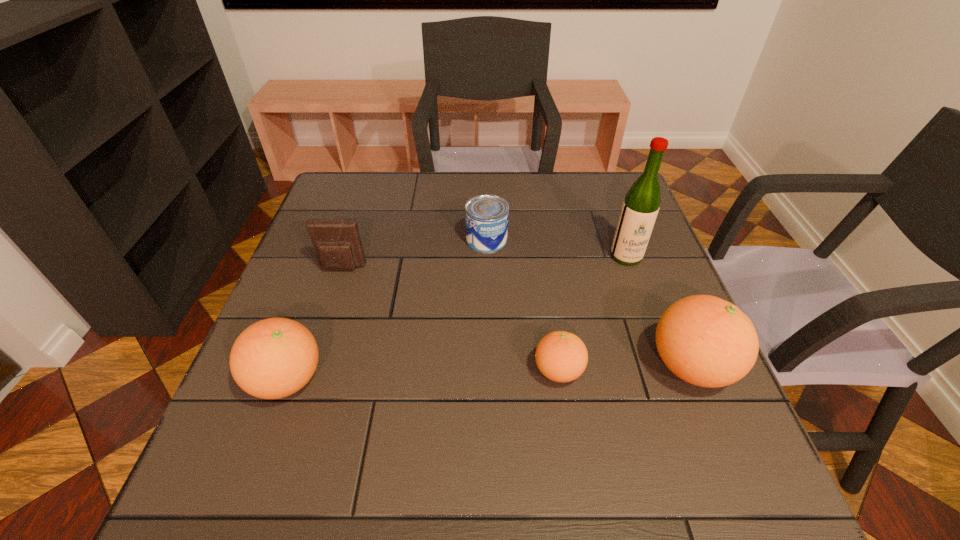
In order to click on the second shortest orange in this screenshot , I will do `click(273, 358)`.

The image size is (960, 540). In order to click on the second orange from left to right in this screenshot , I will do `click(561, 356)`.

Where is `the shortest orange`? The height and width of the screenshot is (540, 960). the shortest orange is located at coordinates point(561,356).

Locate an element on the screen. The height and width of the screenshot is (540, 960). the rightmost orange is located at coordinates (706, 341).

At what (x,y) coordinates should I click in order to perform the action: click on the third object from left to right. Please return your answer as a coordinate pair (x, y). Looking at the image, I should click on (487, 216).

Locate an element on the screen. This screenshot has height=540, width=960. pouch is located at coordinates (337, 244).

Locate an element on the screen. The width and height of the screenshot is (960, 540). the tallest object is located at coordinates (640, 208).

This screenshot has width=960, height=540. Identify the location of vacant area situated 0.130m on the back of the leftmost orange. (315, 303).

Where is `free space located 0.070m on the front of the fourth object from left to right`? free space located 0.070m on the front of the fourth object from left to right is located at coordinates (566, 427).

The width and height of the screenshot is (960, 540). I want to click on blank space located on the back of the rightmost orange, so click(x=632, y=221).